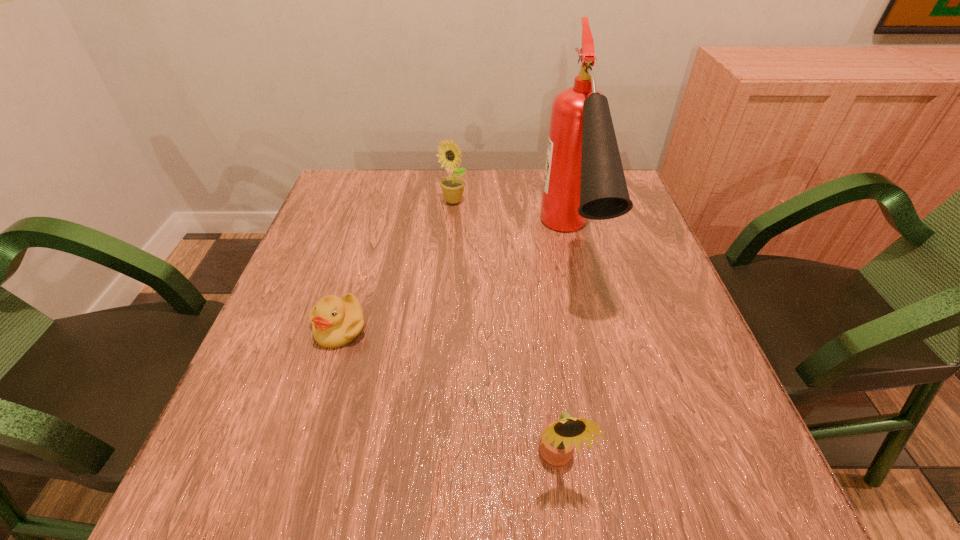
Locate an element on the screen. The height and width of the screenshot is (540, 960). empty space between the right sunflower and the tallest object is located at coordinates (563, 353).

You are a GUI agent. You are given a task and a screenshot of the screen. Output one action in this format:
    pyautogui.click(x=<x>, y=<y>)
    Task: Click on the vacant area that lies between the second object from left to right and the duckling
    
    Given the screenshot: What is the action you would take?
    pyautogui.click(x=396, y=264)

The image size is (960, 540). In order to click on free point between the nearest object and the tallest object in this screenshot , I will do `click(563, 353)`.

Identify which object is located as the nearest to the fire extinguisher. Please provide its 2D coordinates. Your answer should be formatted as a tuple, i.e. [(x, y)], where the tuple contains the x and y coordinates of a point satisfying the conditions above.

[(453, 186)]

Where is `object that is the third closest to the farther sunflower`? This screenshot has height=540, width=960. object that is the third closest to the farther sunflower is located at coordinates (558, 439).